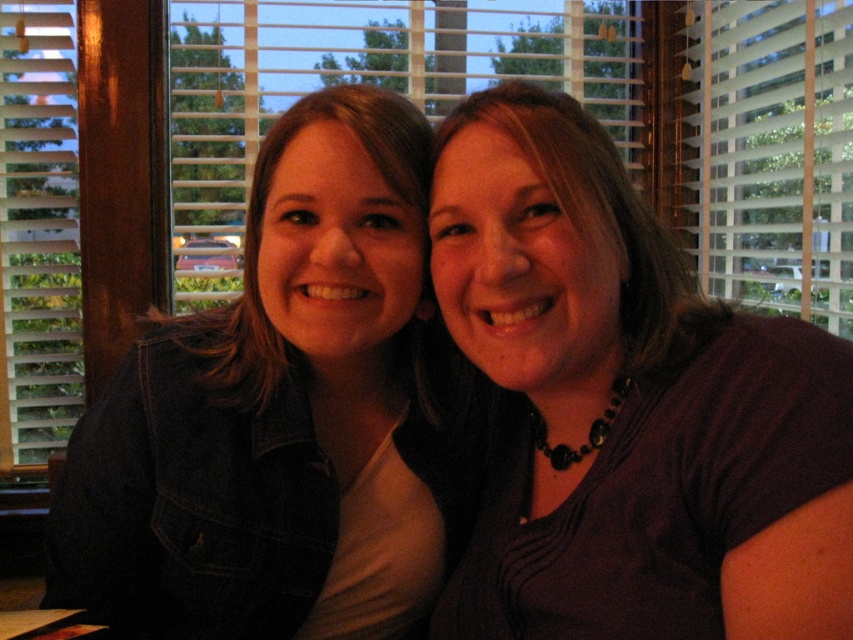
Locate an element on the screen. dark purple shirt at center is located at coordinates (628, 406).

Is dark purple shirt at center positioned at the back of white plastic blinds at upper center?

No, it is not.

Is point (496, 90) farther from viewer compared to point (822, 294)?

No, it is not.

Where is `dark purple shirt at center`? Image resolution: width=853 pixels, height=640 pixels. dark purple shirt at center is located at coordinates (628, 406).

How distant is dark purple shirt at center from denim jacket at left?

The distance of dark purple shirt at center from denim jacket at left is 7.89 inches.

This screenshot has width=853, height=640. What do you see at coordinates (628, 406) in the screenshot?
I see `dark purple shirt at center` at bounding box center [628, 406].

The width and height of the screenshot is (853, 640). I want to click on dark purple shirt at center, so click(x=628, y=406).

Is white plastic blinds at upper center closer to the viewer compared to wooden blinds at upper left?

Yes, it is.

Locate an element on the screen. This screenshot has height=640, width=853. white plastic blinds at upper center is located at coordinates (775, 154).

Locate an element on the screen. white plastic blinds at upper center is located at coordinates (775, 154).